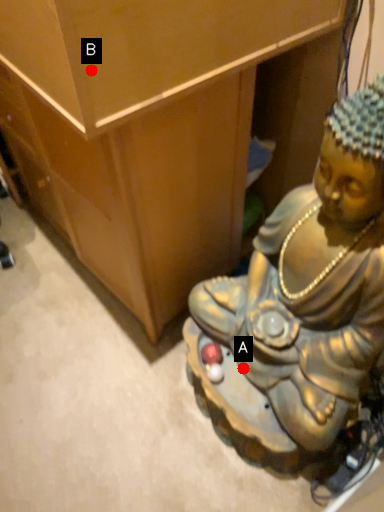
Question: Two points are circled on the image, labeled by A and B beside each circle. Which point is closer to the camera?

Choices:
 (A) A is closer
 (B) B is closer

Answer: (B)